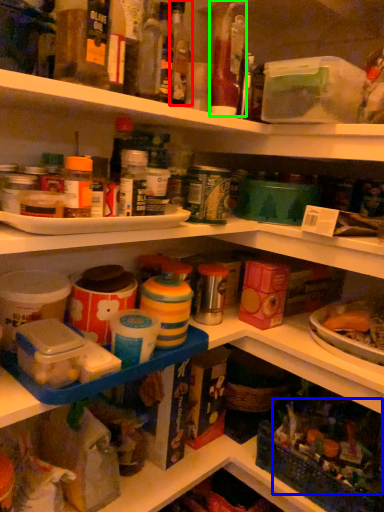
Question: Which object is the closest to the bottle (highlighted by a red box)? Choose among these: food (highlighted by a blue box) or bottle (highlighted by a green box).

Choices:
 (A) food
 (B) bottle

Answer: (B)